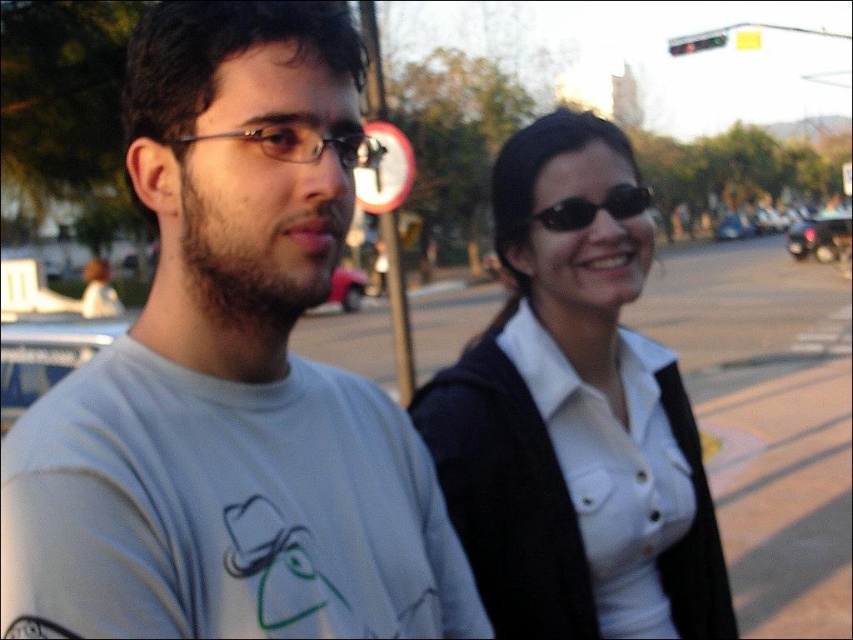
You are a photographer trying to capture a candid shot of the two people in the scene. You want to ensure that both the white matte shirt at center and the black reflective sunglasses at upper right are clearly visible in the frame. Based on their positions, which object should you focus on first to ensure both are in focus?

The white matte shirt at center is located below black reflective sunglasses at upper right. To ensure both are in focus, you should focus on the black reflective sunglasses at upper right first since it is higher up, allowing the depth of field to naturally cover the lower positioned white matte shirt at center.

Consider the image. You are a photographer trying to capture both the clear plastic glasses at left and the black reflective sunglasses at upper right in the same frame. Which pair of glasses should you focus on first if you want to ensure they both appear in focus, considering their sizes?

Since the clear plastic glasses at left are larger in size compared to the black reflective sunglasses at upper right, you should focus on the clear plastic glasses at left first to ensure both are in focus.